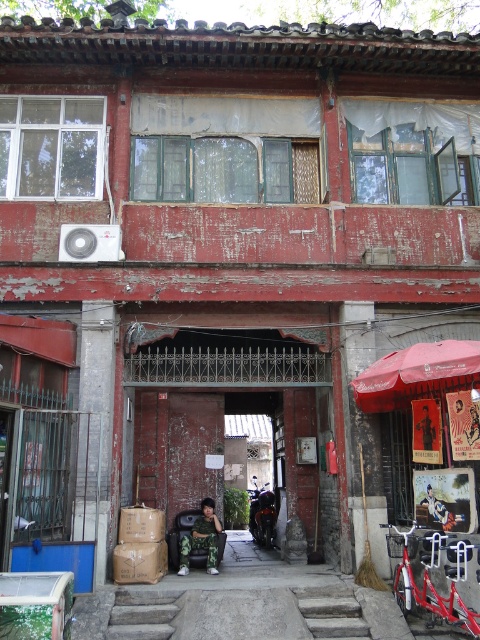
Which of these two, gray stone stairs at center or shiny black motorcycle at center, stands shorter?

With less height is gray stone stairs at center.

Does gray stone stairs at center lie in front of shiny black motorcycle at center?

That is True.

Identify the location of gray stone stairs at center. coord(332,612).

Identify the location of stone steps at center. coord(143,614).

Is point (142, 627) positioned before point (187, 561)?

Yes, point (142, 627) is in front of point (187, 561).

This screenshot has width=480, height=640. Find the location of `stone steps at center`. stone steps at center is located at coordinates (143, 614).

Does stone steps at center have a lesser height compared to shiny black motorcycle at center?

Yes.

Between stone steps at center and shiny black motorcycle at center, which one is positioned higher?

Positioned higher is stone steps at center.

Locate an element on the screen. This screenshot has height=640, width=480. stone steps at center is located at coordinates [143, 614].

Where is `stone steps at center`? stone steps at center is located at coordinates (143, 614).